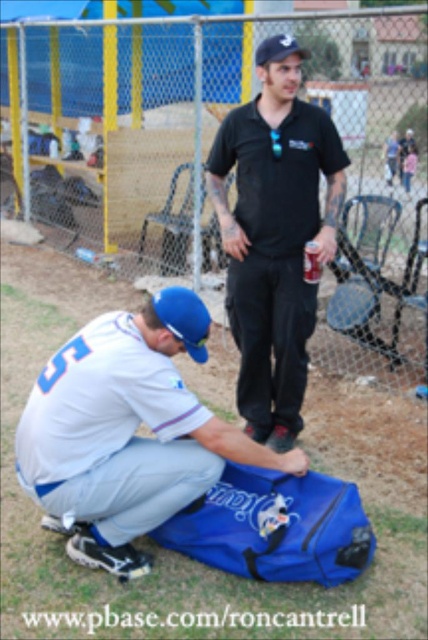
Question: Which object is positioned farthest from the black matte shirt at center?

Choices:
 (A) blue fabric baseball bag at upper right
 (B) blue fabric bag at lower center

Answer: (A)

Question: From the image, what is the correct spatial relationship of black matte shirt at center in relation to blue fabric baseball bag at upper right?

Choices:
 (A) right
 (B) left

Answer: (B)

Question: Among these points, which one is farthest from the camera?

Choices:
 (A) [163, 371]
 (B) [385, 163]

Answer: (B)

Question: Does blue fabric bag at lower center appear under black matte shirt at center?

Choices:
 (A) yes
 (B) no

Answer: (A)

Question: In this image, where is black matte shirt at center located relative to blue fabric baseball bag at upper right?

Choices:
 (A) left
 (B) right

Answer: (A)

Question: Estimate the real-world distances between objects in this image. Which object is closer to the blue fabric bag at lower center?

Choices:
 (A) blue fabric baseball bag at upper right
 (B) black matte shirt at center

Answer: (B)